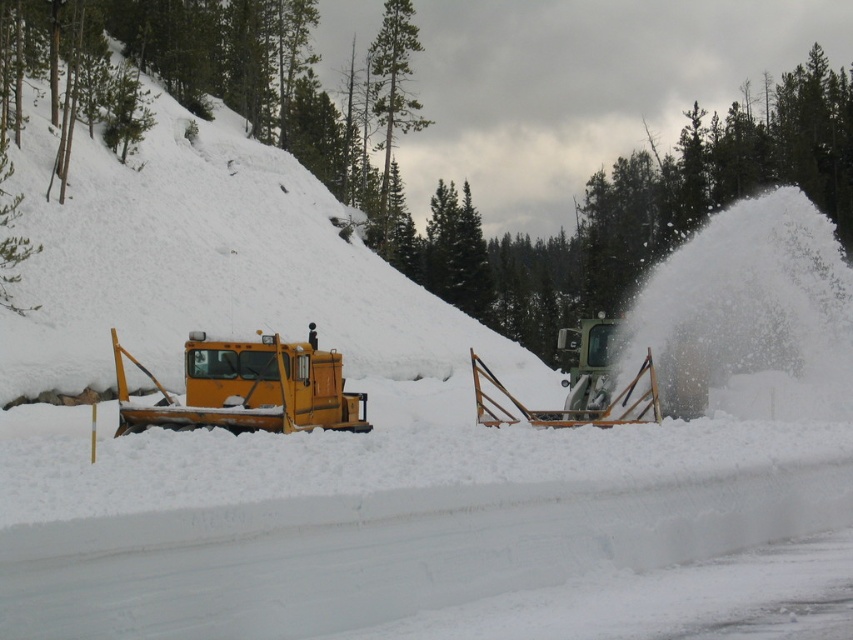
Question: Among these objects, which one is farthest from the camera?

Choices:
 (A) metallic silver plow at center
 (B) yellow matte/snowplow at left

Answer: (B)

Question: Which object appears closest to the camera in this image?

Choices:
 (A) yellow matte/snowplow at left
 (B) metallic silver plow at center

Answer: (B)

Question: Does yellow matte/snowplow at left appear over metallic silver plow at center?

Choices:
 (A) no
 (B) yes

Answer: (B)

Question: Is white snow at upper left further to camera compared to yellow matte/snowplow at left?

Choices:
 (A) yes
 (B) no

Answer: (A)

Question: Based on their relative distances, which object is nearer to the white snow at upper left?

Choices:
 (A) yellow matte/snowplow at left
 (B) metallic silver plow at center

Answer: (B)

Question: Is white snow at upper left closer to camera compared to yellow matte/snowplow at left?

Choices:
 (A) no
 (B) yes

Answer: (A)